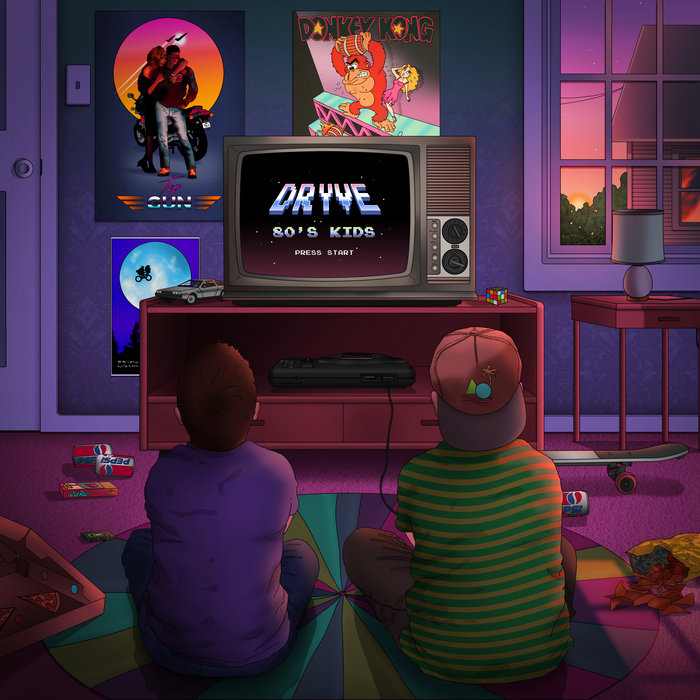
This screenshot has height=700, width=700. I want to click on window, so click(x=617, y=119).